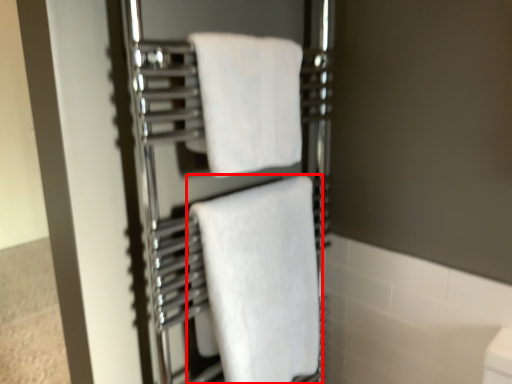
Question: Considering the relative positions of towel (annotated by the red box) and towel in the image provided, where is towel (annotated by the red box) located with respect to the staircase?

Choices:
 (A) left
 (B) right

Answer: (B)